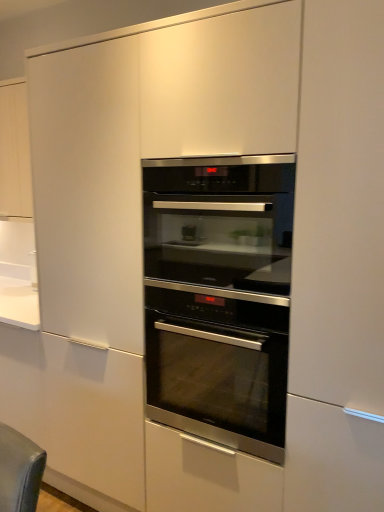
The height and width of the screenshot is (512, 384). Find the location of `stainless steel oven at center, positioned as the 2th oven in bottom-to-top order`. stainless steel oven at center, positioned as the 2th oven in bottom-to-top order is located at coordinates (219, 220).

Describe the element at coordinates (219, 220) in the screenshot. I see `stainless steel oven at center, positioned as the 2th oven in bottom-to-top order` at that location.

The width and height of the screenshot is (384, 512). Describe the element at coordinates (219, 297) in the screenshot. I see `stainless steel oven at center, marked as the 2th oven in a top-to-bottom arrangement` at that location.

In order to face stainless steel oven at center, which ranks as the first oven in bottom-to-top order, should I rotate leftwards or rightwards?

You should rotate right by 5.114 degrees.

Locate an element on the screen. stainless steel oven at center, marked as the 2th oven in a top-to-bottom arrangement is located at coordinates (219, 297).

Identify the location of stainless steel oven at center, positioned as the 2th oven in bottom-to-top order. The width and height of the screenshot is (384, 512). (219, 220).

Considering the positions of objects stainless steel oven at center, positioned as the 2th oven in bottom-to-top order, and stainless steel oven at center, marked as the 2th oven in a top-to-bottom arrangement, in the image provided, who is more to the left, stainless steel oven at center, positioned as the 2th oven in bottom-to-top order, or stainless steel oven at center, marked as the 2th oven in a top-to-bottom arrangement,?

stainless steel oven at center, marked as the 2th oven in a top-to-bottom arrangement.

From the picture: Does stainless steel oven at center, positioned as the 2th oven in bottom-to-top order, come behind stainless steel oven at center, which ranks as the first oven in bottom-to-top order?

No, stainless steel oven at center, positioned as the 2th oven in bottom-to-top order, is closer to the camera.

Which is in front, point (255, 240) or point (261, 188)?

The point (261, 188) is closer to the camera.

From the image's perspective, between stainless steel oven at center, which is counted as the 1th oven, starting from the top, and stainless steel oven at center, which ranks as the first oven in bottom-to-top order, which one is located above?

stainless steel oven at center, which is counted as the 1th oven, starting from the top.

Consider the image. From a real-world perspective, who is located lower, stainless steel oven at center, positioned as the 2th oven in bottom-to-top order, or stainless steel oven at center, which ranks as the first oven in bottom-to-top order?

stainless steel oven at center, which ranks as the first oven in bottom-to-top order.

Is stainless steel oven at center, positioned as the 2th oven in bottom-to-top order, wider than stainless steel oven at center, which ranks as the first oven in bottom-to-top order?

No.

Which of these two, stainless steel oven at center, positioned as the 2th oven in bottom-to-top order, or stainless steel oven at center, which ranks as the first oven in bottom-to-top order, stands taller?

With more height is stainless steel oven at center, which ranks as the first oven in bottom-to-top order.

Can you confirm if stainless steel oven at center, positioned as the 2th oven in bottom-to-top order, is bigger than stainless steel oven at center, which ranks as the first oven in bottom-to-top order?

Actually, stainless steel oven at center, positioned as the 2th oven in bottom-to-top order, might be smaller than stainless steel oven at center, which ranks as the first oven in bottom-to-top order.

Is stainless steel oven at center, which is counted as the 1th oven, starting from the top, inside the boundaries of stainless steel oven at center, marked as the 2th oven in a top-to-bottom arrangement, or outside?

stainless steel oven at center, which is counted as the 1th oven, starting from the top, lies outside stainless steel oven at center, marked as the 2th oven in a top-to-bottom arrangement.

Does stainless steel oven at center, which is counted as the 1th oven, starting from the top, touch stainless steel oven at center, which ranks as the first oven in bottom-to-top order?

Yes, stainless steel oven at center, which is counted as the 1th oven, starting from the top, is next to stainless steel oven at center, which ranks as the first oven in bottom-to-top order.

Is stainless steel oven at center, positioned as the 2th oven in bottom-to-top order, oriented away from stainless steel oven at center, marked as the 2th oven in a top-to-bottom arrangement?

No, stainless steel oven at center, positioned as the 2th oven in bottom-to-top order,'s orientation is not away from stainless steel oven at center, marked as the 2th oven in a top-to-bottom arrangement.

Can you tell me how much stainless steel oven at center, positioned as the 2th oven in bottom-to-top order, and stainless steel oven at center, which ranks as the first oven in bottom-to-top order, differ in facing direction?

0.0645 degrees separate the facing orientations of stainless steel oven at center, positioned as the 2th oven in bottom-to-top order, and stainless steel oven at center, which ranks as the first oven in bottom-to-top order.

How much distance is there between stainless steel oven at center, positioned as the 2th oven in bottom-to-top order, and stainless steel oven at center, marked as the 2th oven in a top-to-bottom arrangement?

A distance of 3.58 inches exists between stainless steel oven at center, positioned as the 2th oven in bottom-to-top order, and stainless steel oven at center, marked as the 2th oven in a top-to-bottom arrangement.

Find the location of a particular element. oven below the stainless steel oven at center, positioned as the 2th oven in bottom-to-top order (from a real-world perspective) is located at coordinates (219, 297).

Which object is positioned more to the right, stainless steel oven at center, marked as the 2th oven in a top-to-bottom arrangement, or stainless steel oven at center, positioned as the 2th oven in bottom-to-top order?

stainless steel oven at center, positioned as the 2th oven in bottom-to-top order.

Which object is further away from the camera, stainless steel oven at center, marked as the 2th oven in a top-to-bottom arrangement, or stainless steel oven at center, which is counted as the 1th oven, starting from the top?

stainless steel oven at center, marked as the 2th oven in a top-to-bottom arrangement, is further from the camera.

Does point (196, 280) come in front of point (279, 210)?

No, it is behind (279, 210).

From the image's perspective, is stainless steel oven at center, which ranks as the first oven in bottom-to-top order, under stainless steel oven at center, which is counted as the 1th oven, starting from the top?

Correct, stainless steel oven at center, which ranks as the first oven in bottom-to-top order, appears lower than stainless steel oven at center, which is counted as the 1th oven, starting from the top, in the image.

From a real-world perspective, who is located lower, stainless steel oven at center, which ranks as the first oven in bottom-to-top order, or stainless steel oven at center, which is counted as the 1th oven, starting from the top?

stainless steel oven at center, which ranks as the first oven in bottom-to-top order, from a real-world perspective.

Looking at their sizes, would you say stainless steel oven at center, which ranks as the first oven in bottom-to-top order, is wider or thinner than stainless steel oven at center, which is counted as the 1th oven, starting from the top?

stainless steel oven at center, which ranks as the first oven in bottom-to-top order, is wider than stainless steel oven at center, which is counted as the 1th oven, starting from the top.

Considering the relative sizes of stainless steel oven at center, which ranks as the first oven in bottom-to-top order, and stainless steel oven at center, positioned as the 2th oven in bottom-to-top order, in the image provided, is stainless steel oven at center, which ranks as the first oven in bottom-to-top order, taller than stainless steel oven at center, positioned as the 2th oven in bottom-to-top order,?

Correct, stainless steel oven at center, which ranks as the first oven in bottom-to-top order, is much taller as stainless steel oven at center, positioned as the 2th oven in bottom-to-top order.

Looking at the image, does stainless steel oven at center, marked as the 2th oven in a top-to-bottom arrangement, seem bigger or smaller compared to stainless steel oven at center, which is counted as the 1th oven, starting from the top?

Considering their sizes, stainless steel oven at center, marked as the 2th oven in a top-to-bottom arrangement, takes up more space than stainless steel oven at center, which is counted as the 1th oven, starting from the top.

Is stainless steel oven at center, marked as the 2th oven in a top-to-bottom arrangement, outside of stainless steel oven at center, which is counted as the 1th oven, starting from the top?

Yes.

Is stainless steel oven at center, marked as the 2th oven in a top-to-bottom arrangement, next to stainless steel oven at center, which is counted as the 1th oven, starting from the top, and touching it?

Yes, stainless steel oven at center, marked as the 2th oven in a top-to-bottom arrangement, and stainless steel oven at center, which is counted as the 1th oven, starting from the top, clearly make contact.

Is stainless steel oven at center, which ranks as the first oven in bottom-to-top order, oriented away from stainless steel oven at center, which is counted as the 1th oven, starting from the top?

No.

Find the location of `oven lying on the left of stainless steel oven at center, which is counted as the 1th oven, starting from the top`. oven lying on the left of stainless steel oven at center, which is counted as the 1th oven, starting from the top is located at coordinates (219, 297).

In the image, there is a stainless steel oven at center, marked as the 2th oven in a top-to-bottom arrangement. Identify the location of oven above it (from the image's perspective). The image size is (384, 512). (219, 220).

This screenshot has width=384, height=512. In the image, there is a stainless steel oven at center, which is counted as the 1th oven, starting from the top. Find the location of `oven below it (from the image's perspective)`. oven below it (from the image's perspective) is located at coordinates (219, 297).